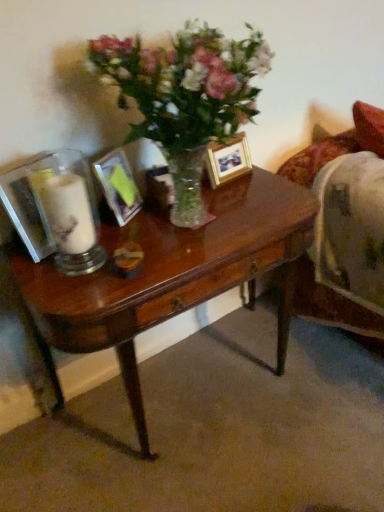
Where is `space that is in front of metallic silver picture frame at center, the 2th picture frame from the right`? space that is in front of metallic silver picture frame at center, the 2th picture frame from the right is located at coordinates (130, 234).